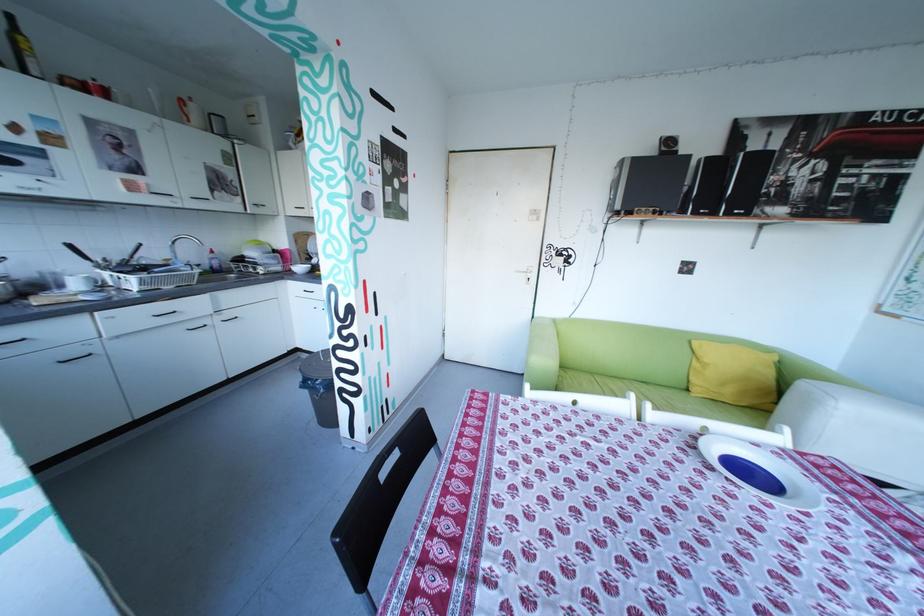
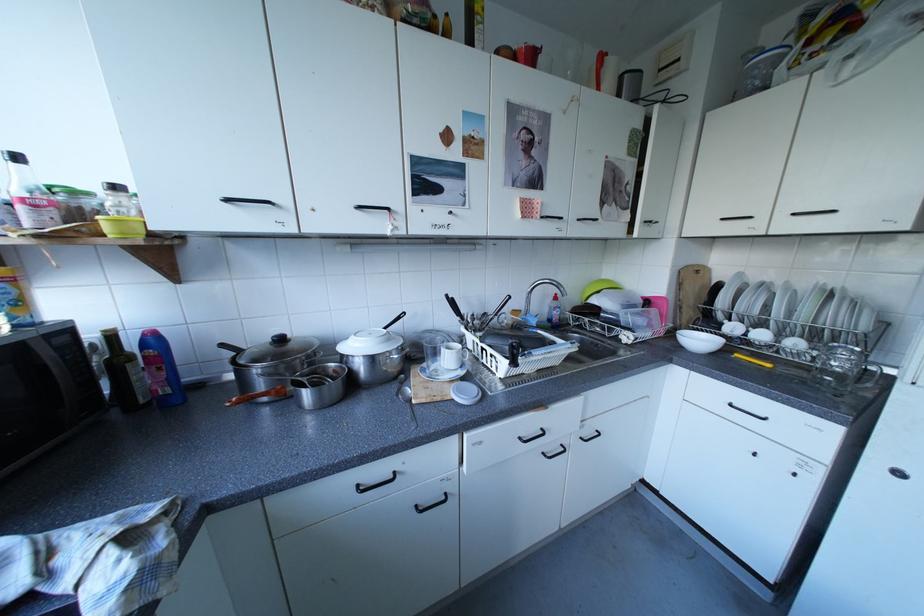
Locate, in the second image, the point that corresponds to point 220,261 in the first image.

(558, 310)